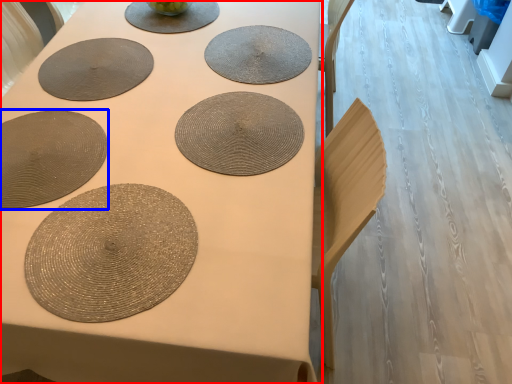
Question: Which of the following is the farthest to the observer, table (highlighted by a red box) or paper plate (highlighted by a blue box)?

Choices:
 (A) table
 (B) paper plate

Answer: (B)